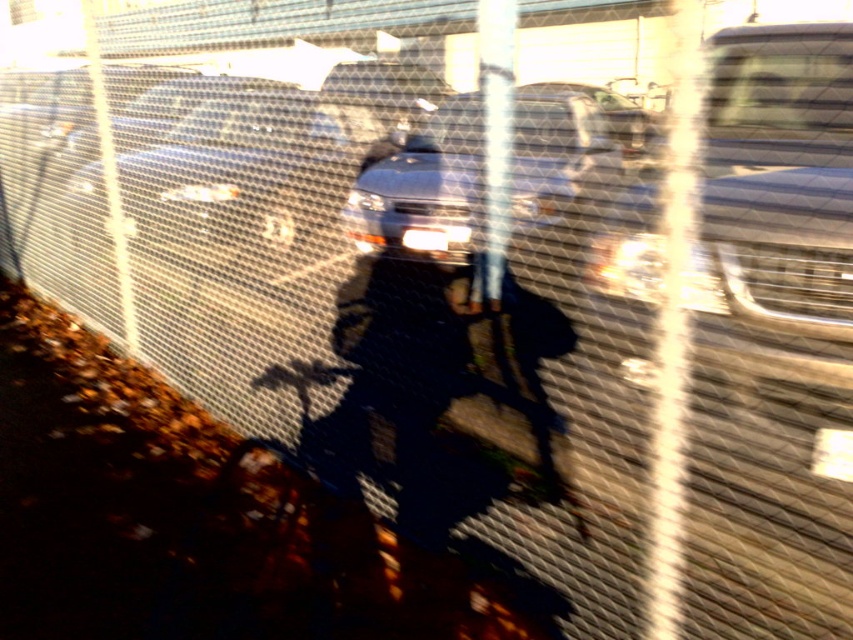
Question: Which object is the farthest from the metallic silver bicycle at center?

Choices:
 (A) metallic silver car at center
 (B) satin silver sedan at center

Answer: (A)

Question: Considering the relative positions of metallic silver bicycle at center and satin silver sedan at center in the image provided, where is metallic silver bicycle at center located with respect to satin silver sedan at center?

Choices:
 (A) above
 (B) below

Answer: (B)

Question: Which is farther from the metallic silver bicycle at center?

Choices:
 (A) satin silver sedan at center
 (B) metallic silver car at center

Answer: (B)

Question: Which point is farther from the camera taking this photo?

Choices:
 (A) (265, 122)
 (B) (419, 179)

Answer: (A)

Question: Is metallic silver car at center smaller than satin silver sedan at center?

Choices:
 (A) yes
 (B) no

Answer: (A)

Question: Can you confirm if metallic silver bicycle at center is thinner than satin silver sedan at center?

Choices:
 (A) no
 (B) yes

Answer: (B)